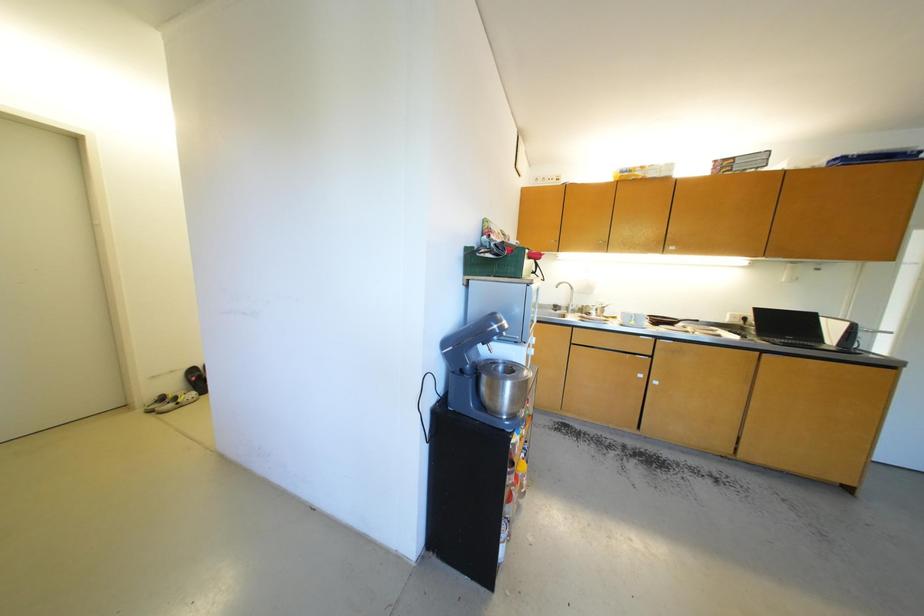
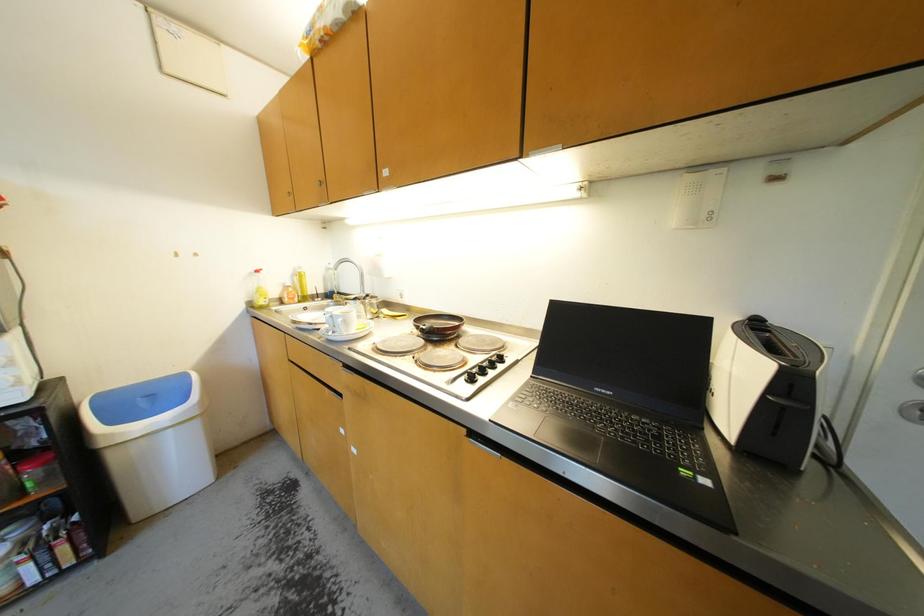
In a continuous first-person perspective shot, in which direction is the camera moving?

The cameraman moved toward right, forward.